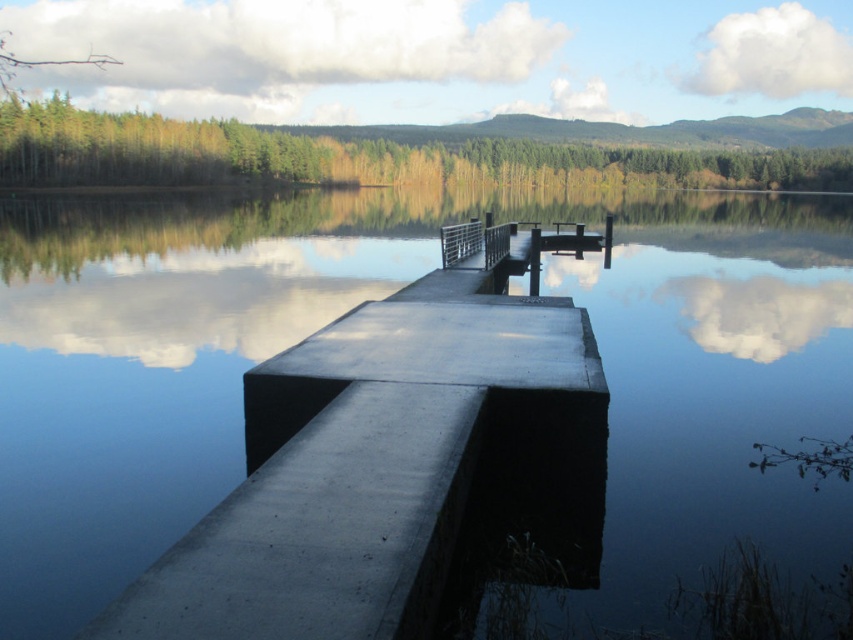
From the picture: You are standing on the dock and looking towards the water. Which object, the smooth blue water at center or the satin silver railing at center, is closer to you?

The smooth blue water at center is closer to you because it is in front of the satin silver railing at center.

You are standing on the concrete dock and see a point marked at coordinates (376, 298). Based on the scene description, where is this point located?

The point is on the smooth blue water at center.

You are standing on the concrete dock and want to place a 10 feet long wooden board horizontally so that both ends touch the smooth blue water at center. Is this possible?

The distance between the concrete dock and the smooth blue water at center is 11.89 feet. Since the wooden board is 10 feet long, it can span the gap and touch both ends.